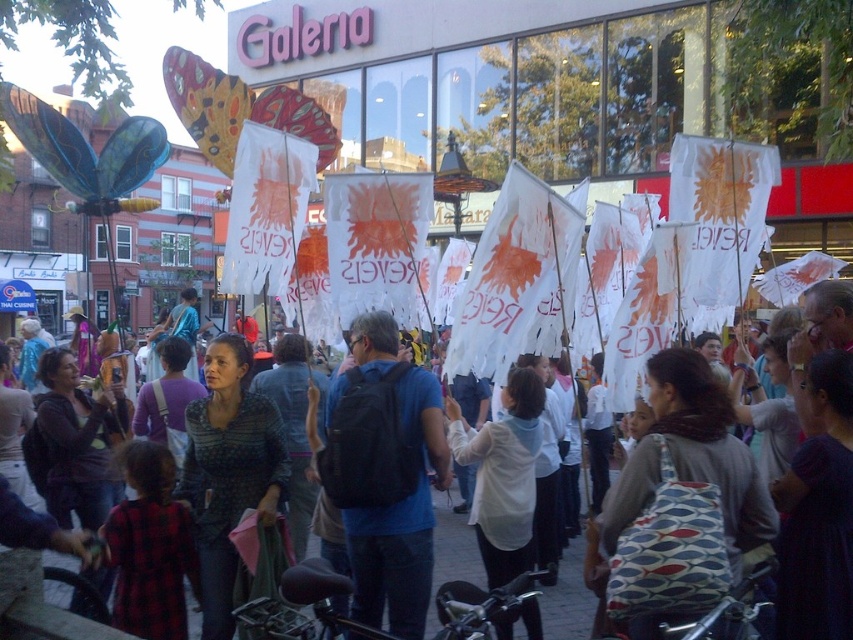
What are the coordinates of the white matte shirt at center?

The white matte shirt at center is located at coordinates point (503, 474).

You are a photographer trying to capture the protest scene. You notice the white matte shirt at center and the white paper flags at center. Which object is positioned closer to you?

The white matte shirt at center is closer to the viewer than the white paper flags at center.